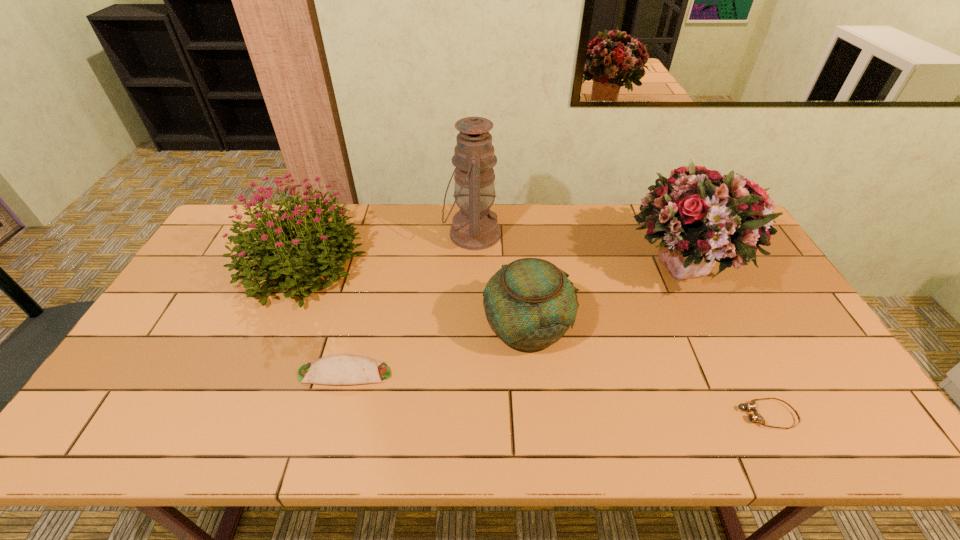
This screenshot has width=960, height=540. I want to click on vacant space in between the shortest object and the oil lamp, so click(x=619, y=325).

The width and height of the screenshot is (960, 540). Identify the location of free spot between the nearest object and the tallest object. 619,325.

What are the coordinates of `unoccupied area between the left bouquet and the right bouquet` in the screenshot? It's located at (492, 268).

Find the location of a particular element. This screenshot has width=960, height=540. unoccupied area between the nearest object and the oil lamp is located at coordinates (619, 325).

Image resolution: width=960 pixels, height=540 pixels. I want to click on vacant area that lies between the right bouquet and the oil lamp, so click(579, 253).

Locate an element on the screen. The image size is (960, 540). free spot between the left bouquet and the pottery is located at coordinates (414, 296).

Find the location of a particular element. vacant area between the second shortest object and the shortest object is located at coordinates (556, 394).

You are a GUI agent. You are given a task and a screenshot of the screen. Output one action in this format:
    pyautogui.click(x=<x>, y=<y>)
    Task: Click on the empty space that is in between the tallest object and the right bouquet
    This screenshot has height=540, width=960.
    Given the screenshot: What is the action you would take?
    coord(579,253)

The height and width of the screenshot is (540, 960). What are the coordinates of `unoccupied position between the tallest object and the left bouquet` in the screenshot? It's located at (386, 249).

I want to click on object that is the fifth nearest to the second shortest object, so click(x=751, y=406).